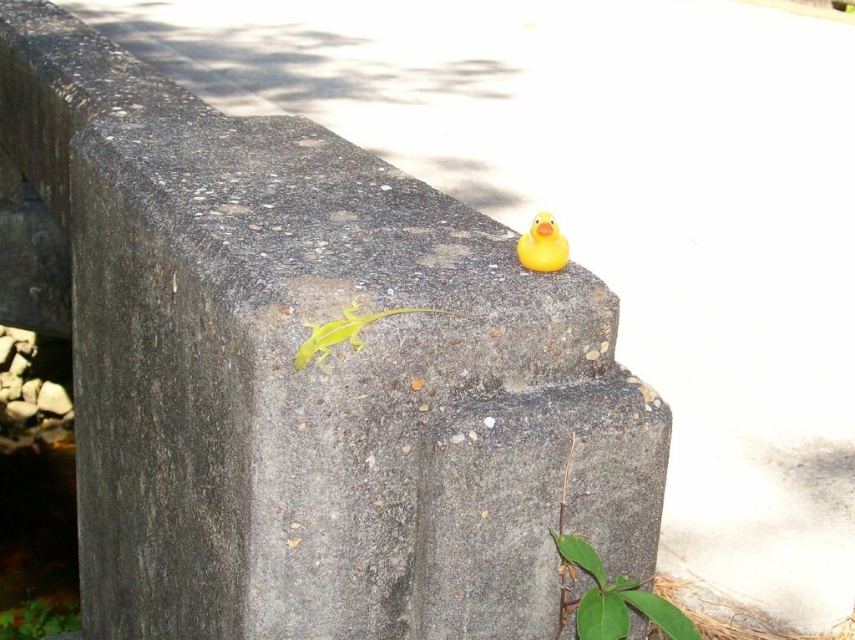
Question: Is smooth green lizard at center in front of rubber duck at upper right?

Choices:
 (A) yes
 (B) no

Answer: (A)

Question: Does smooth green lizard at center come in front of rubber duck at upper right?

Choices:
 (A) no
 (B) yes

Answer: (B)

Question: Is smooth green lizard at center to the left of rubber duck at upper right from the viewer's perspective?

Choices:
 (A) no
 (B) yes

Answer: (B)

Question: Which of the following is the farthest from the observer?

Choices:
 (A) smooth green lizard at center
 (B) rubber duck at upper right

Answer: (B)